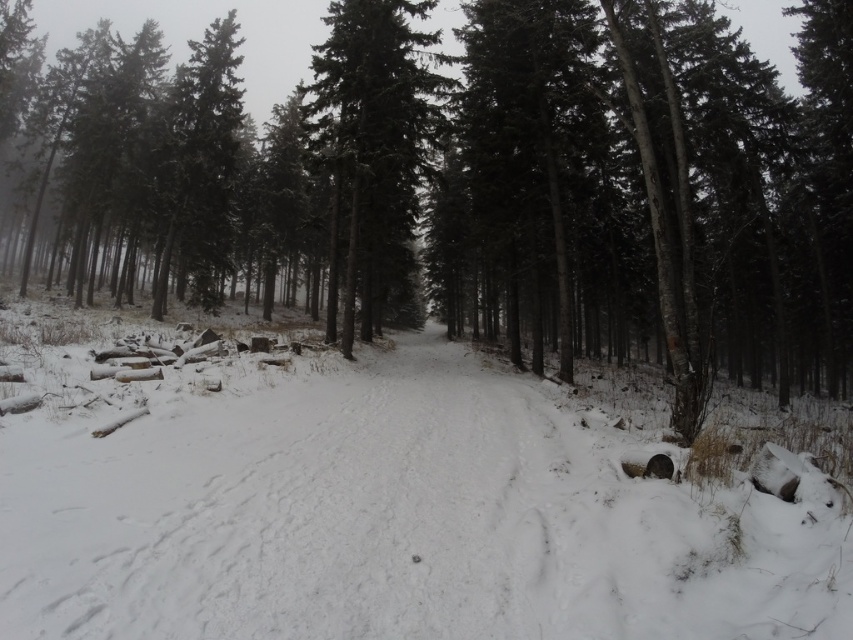
Question: Which of the following is the farthest from the observer?

Choices:
 (A) white fluffy snow at center
 (B) smooth dark green tree at center

Answer: (B)

Question: Is white fluffy snow at center smaller than smooth dark green tree at center?

Choices:
 (A) yes
 (B) no

Answer: (A)

Question: Which point is closer to the camera?

Choices:
 (A) (434, 224)
 (B) (407, 163)

Answer: (B)

Question: Where is green matte tree at center located in relation to smooth dark green tree at center in the image?

Choices:
 (A) above
 (B) below

Answer: (A)

Question: Considering the real-world distances, which object is farthest from the green matte tree at center?

Choices:
 (A) smooth dark green tree at center
 (B) white fluffy snow at center

Answer: (B)

Question: Where is white fluffy snow at center located in relation to smooth dark green tree at center in the image?

Choices:
 (A) below
 (B) above

Answer: (A)